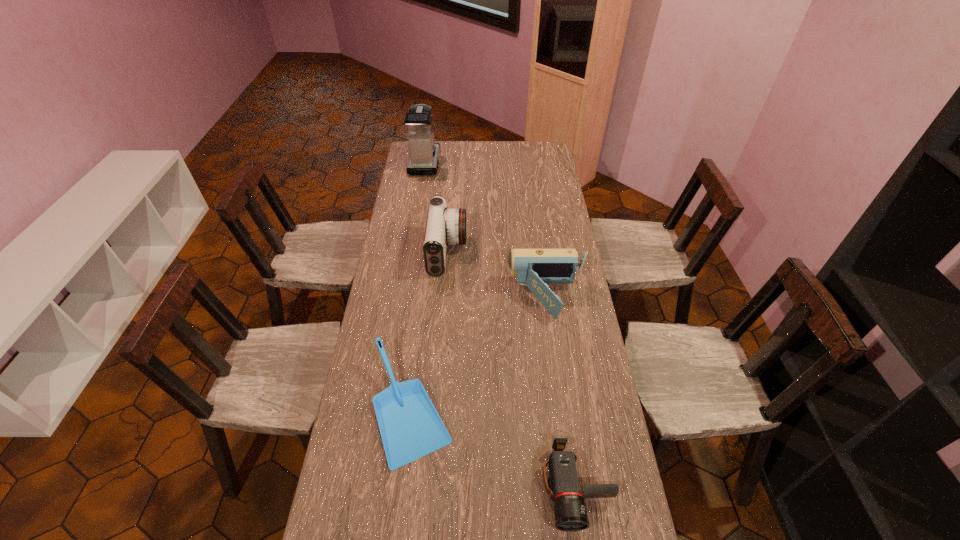
The height and width of the screenshot is (540, 960). In order to click on vacant space at the right edge in this screenshot , I will do `click(553, 348)`.

Locate an element on the screen. free spot between the second tallest camcorder and the fourth tallest object is located at coordinates (479, 353).

Image resolution: width=960 pixels, height=540 pixels. Find the location of `vacant area between the tallest camcorder and the second tallest camcorder`. vacant area between the tallest camcorder and the second tallest camcorder is located at coordinates (497, 275).

The width and height of the screenshot is (960, 540). I want to click on blank region between the third tallest object and the shortest object, so click(x=562, y=392).

The width and height of the screenshot is (960, 540). In order to click on free space between the fourth tallest object and the third shortest object in this screenshot , I will do `click(479, 353)`.

This screenshot has height=540, width=960. Find the location of `free point between the fourth shortest object and the second shortest object`. free point between the fourth shortest object and the second shortest object is located at coordinates (430, 330).

Identify the location of vacant area that lies between the shortest object and the coffee maker. (501, 325).

Image resolution: width=960 pixels, height=540 pixels. Identify the location of empty location between the shortest object and the second shortest object. (494, 448).

You are a GUI agent. You are given a task and a screenshot of the screen. Output one action in this format:
    pyautogui.click(x=<x>, y=<y>)
    Task: Click on the vacant region between the shortest object and the third tallest object
    Image resolution: width=960 pixels, height=540 pixels.
    Given the screenshot: What is the action you would take?
    pyautogui.click(x=562, y=392)

Identify which object is the fourth nearest to the coffee maker. Please provide its 2D coordinates. Your answer should be formatted as a tuple, i.e. [(x, y)], where the tuple contains the x and y coordinates of a point satisfying the conditions above.

[(570, 511)]